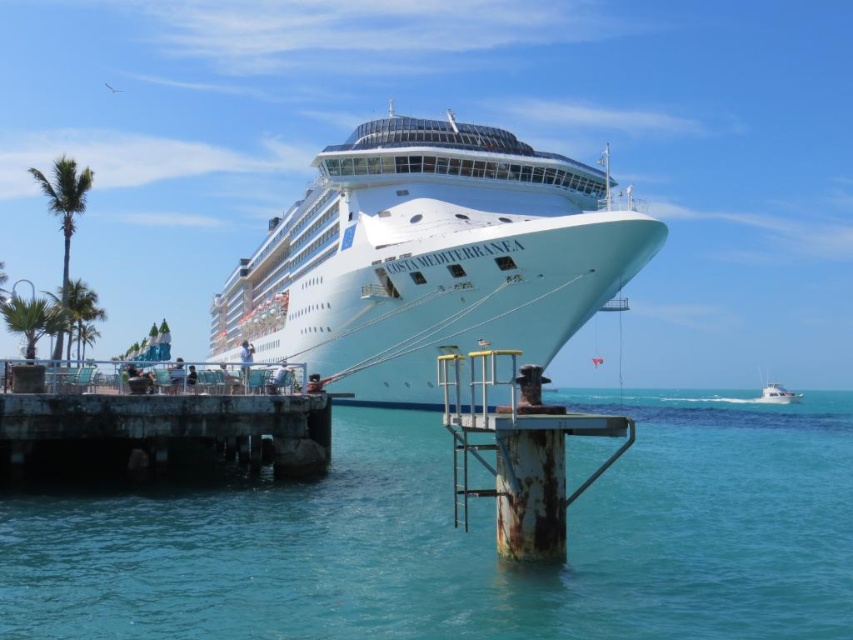
You are standing on the pier next to the Costa Mediterranea cruise ship. You notice two points marked on the image. The first point is at coordinates point [323,154] and the second is at point [784,388]. If you want to walk towards the ship from the pier, which point should you aim for to be closer to the ship?

Point [323,154] is in front of point [784,388], so if you aim for point [323,154], you will be closer to the ship.

You are standing on the deck of the Costa Mediterranea facing the pier. Where is the rusty metal dock at lower left located in relation to your position?

The rusty metal dock at lower left is located at point (157, 429) relative to your position on the deck.

You are standing on the pier and want to take a photo of the clear blue water at lower left. Based on its coordinates, where should you aim your camera?

The clear blue water at lower left is located at coordinates point (465, 540), so you should aim your camera towards that point.